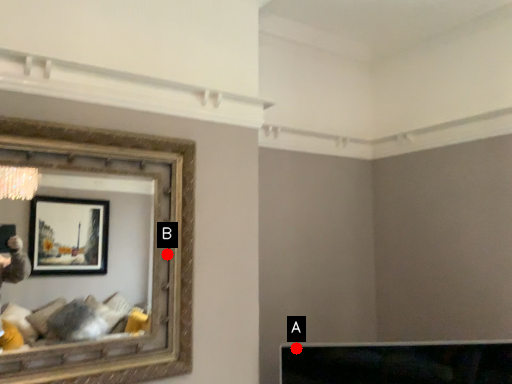
Question: Two points are circled on the image, labeled by A and B beside each circle. Which point is farther from the camera taking this photo?

Choices:
 (A) A is further
 (B) B is further

Answer: (A)